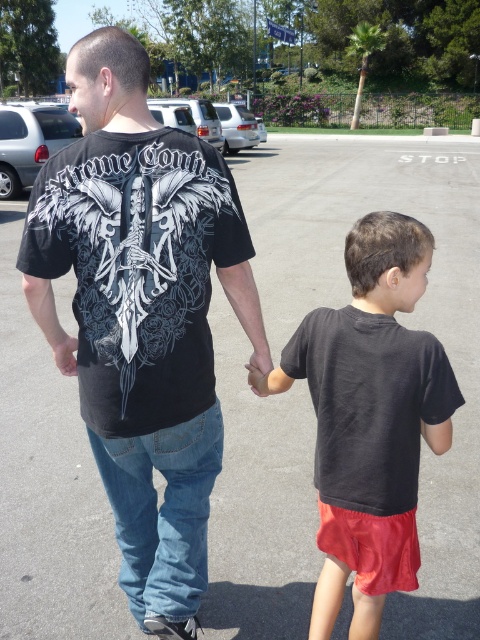
Which is more to the right, black matte t-shirt at upper center or dark gray cotton shirt at center?

Positioned to the right is dark gray cotton shirt at center.

Who is positioned more to the left, black matte t-shirt at upper center or dark gray cotton shirt at center?

From the viewer's perspective, black matte t-shirt at upper center appears more on the left side.

Locate an element on the screen. The width and height of the screenshot is (480, 640). black matte t-shirt at upper center is located at coordinates (137, 268).

Is black matte t-shirt at center shorter than black matte t-shirt at upper center?

Incorrect, black matte t-shirt at center's height does not fall short of black matte t-shirt at upper center's.

Does black matte t-shirt at center appear on the left side of black matte t-shirt at upper center?

Correct, you'll find black matte t-shirt at center to the left of black matte t-shirt at upper center.

You are a GUI agent. You are given a task and a screenshot of the screen. Output one action in this format:
    pyautogui.click(x=<x>, y=<y>)
    Task: Click on the black matte t-shirt at center
    
    Given the screenshot: What is the action you would take?
    tap(142, 314)

You are a GUI agent. You are given a task and a screenshot of the screen. Output one action in this format:
    pyautogui.click(x=<x>, y=<y>)
    Task: Click on the black matte t-shirt at center
    Image resolution: width=480 pixels, height=640 pixels.
    Given the screenshot: What is the action you would take?
    pyautogui.click(x=142, y=314)

Can you confirm if black matte t-shirt at center is shorter than dark gray cotton shirt at center?

Incorrect, black matte t-shirt at center's height does not fall short of dark gray cotton shirt at center's.

Where is `black matte t-shirt at center`? This screenshot has width=480, height=640. black matte t-shirt at center is located at coordinates (142, 314).

The image size is (480, 640). Describe the element at coordinates (142, 314) in the screenshot. I see `black matte t-shirt at center` at that location.

Locate an element on the screen. black matte t-shirt at center is located at coordinates (142, 314).